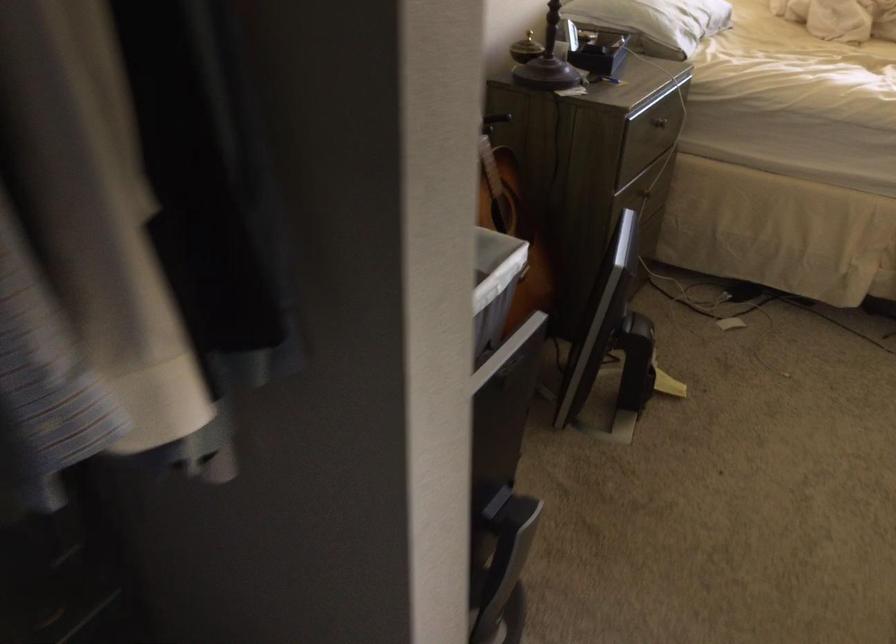
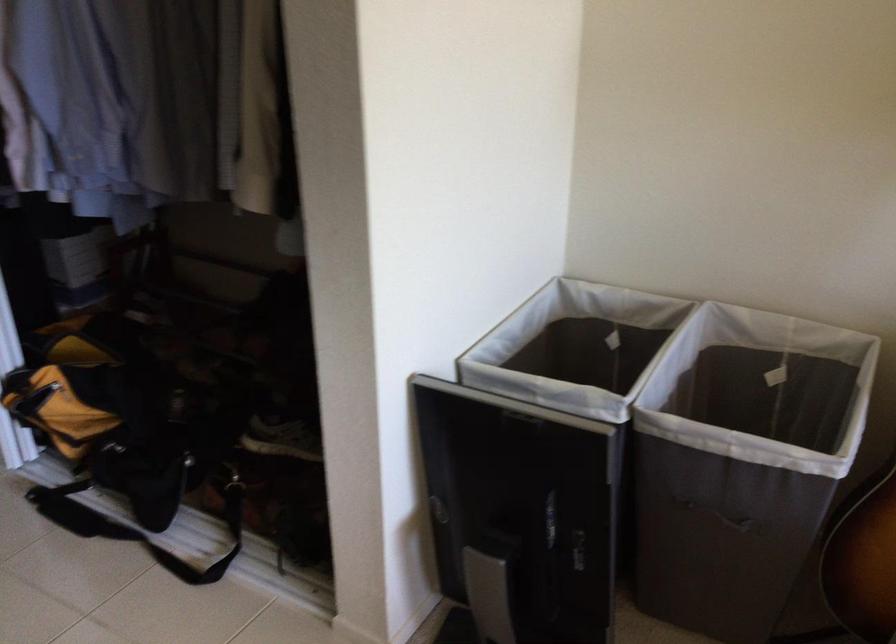
The point at (x=488, y=308) is marked in the first image. Where is the corresponding point in the second image?

(742, 462)